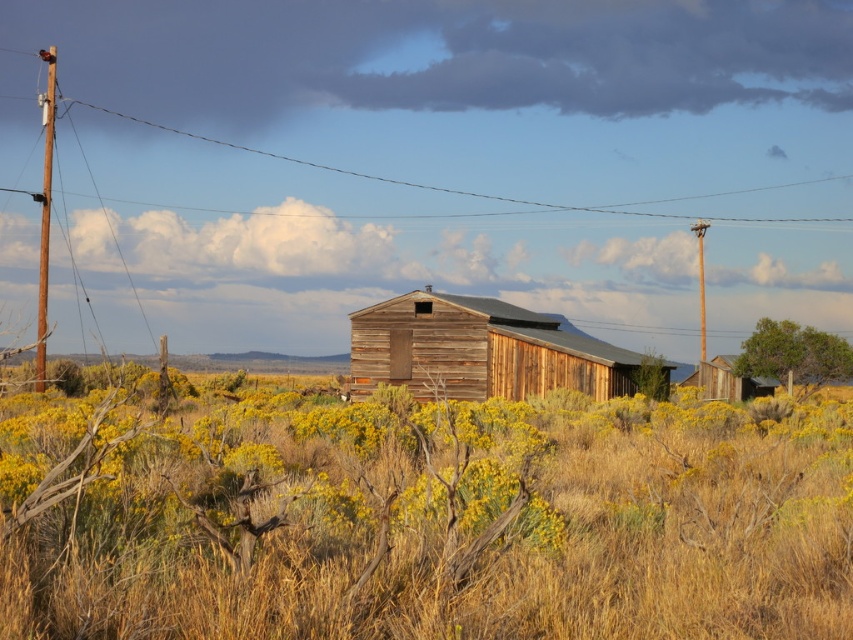
Question: Is weathered wood barn at center positioned behind wooden hut at right?

Choices:
 (A) no
 (B) yes

Answer: (A)

Question: Which object is positioned farthest from the wooden telegraph pole at left?

Choices:
 (A) dry grass at center
 (B) wooden hut at right

Answer: (B)

Question: Where is dry grass at center located in relation to wooden hut at right in the image?

Choices:
 (A) right
 (B) left

Answer: (B)

Question: Is dry grass at center wider than weathered wood barn at center?

Choices:
 (A) no
 (B) yes

Answer: (B)

Question: Based on their relative distances, which object is farther from the brown wooden telegraph pole at right?

Choices:
 (A) wooden hut at right
 (B) weathered wood barn at center
 (C) wooden telegraph pole at left
 (D) dry grass at center

Answer: (C)

Question: Which point is farther from the camera taking this photo?

Choices:
 (A) (590, 388)
 (B) (585, 618)

Answer: (A)